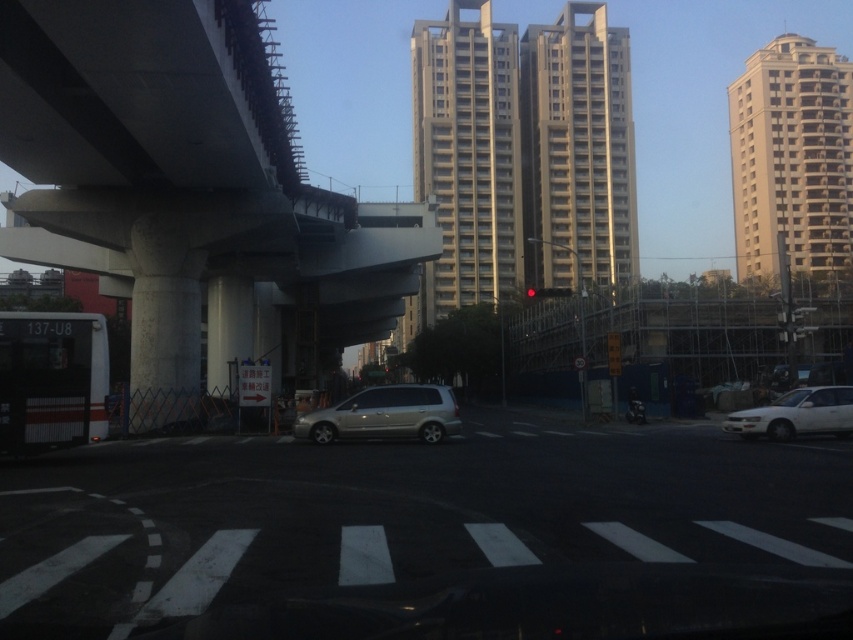
You are driving a car that is 5 meters long. You see the satin silver minivan at center and the red glass traffic light at center in the image. Is there enough space between them to safely park your car?

The satin silver minivan at center and red glass traffic light at center are 28.84 meters apart from each other. Since your car is only 5 meters long, there is plenty of space between them to safely park your car.

You are a delivery driver who needs to park your truck between the beige concrete building at center and the concrete at center. The truck is 60 feet long. Is there enough space between them to park your truck?

The distance between the beige concrete building at center and the concrete at center is 293.86 feet, which is more than enough to accommodate a 60 feet long truck. Yes, there is sufficient space to park the truck between them.

You are standing at the origin point of the image coordinate system. The origin is at the bottom left corner of the image. The coordinates are normalized between 0 and 1. You want to walk to the concrete at left. What direction should you go?

The concrete at left is located at coordinates point (190, 193). Since the origin is at the bottom left corner, moving towards the right increases the x coordinate and moving up increases the y coordinate. To reach the concrete at left, you should move right to 0.303 in the x direction and up to 0.224 in the y direction.